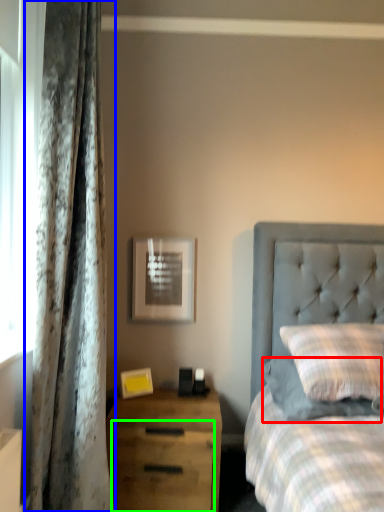
Question: Which object is the closest to the pillow (highlighted by a red box)? Choose among these: curtain (highlighted by a blue box) or drawer (highlighted by a green box).

Choices:
 (A) curtain
 (B) drawer

Answer: (B)